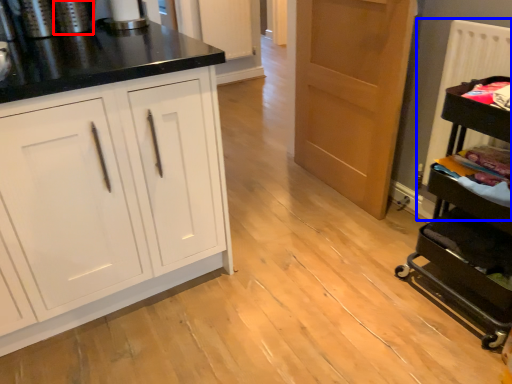
Question: Which object is further to the camera taking this photo, appliance (highlighted by a red box) or radiator (highlighted by a blue box)?

Choices:
 (A) appliance
 (B) radiator

Answer: (A)